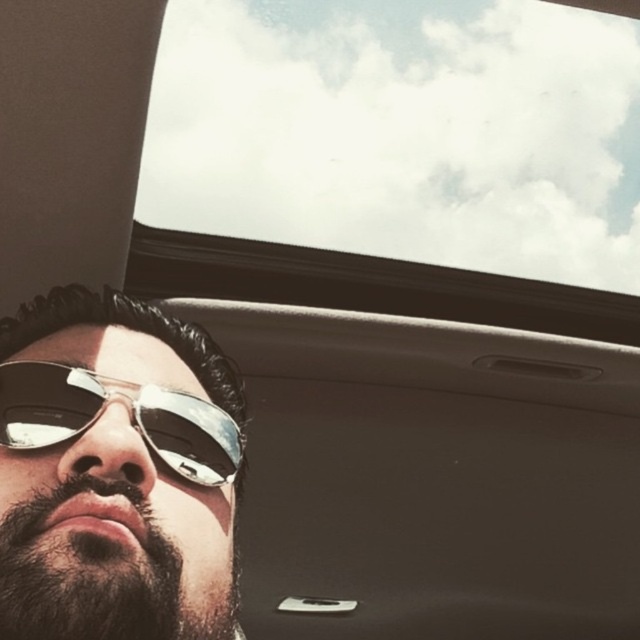
Question: Does transparent glass car window at upper center appear on the right side of dark brown fuzzy beard at lower left?

Choices:
 (A) no
 (B) yes

Answer: (B)

Question: Which point is farther to the camera?

Choices:
 (A) dark brown fuzzy beard at lower left
 (B) transparent glass car window at upper center
 (C) shiny metallic sunglasses at lower left

Answer: (B)

Question: Considering the relative positions of transparent glass car window at upper center and dark brown fuzzy beard at lower left in the image provided, where is transparent glass car window at upper center located with respect to dark brown fuzzy beard at lower left?

Choices:
 (A) left
 (B) right

Answer: (B)

Question: Among these points, which one is nearest to the camera?

Choices:
 (A) (13, 616)
 (B) (225, 273)
 (C) (221, 440)
 (D) (16, 552)

Answer: (A)

Question: Which point is closer to the camera?

Choices:
 (A) (189, 477)
 (B) (320, 44)

Answer: (A)

Question: Can you confirm if dark brown fuzzy beard at lower left is positioned to the right of metallic reflective sunglasses at lower left?

Choices:
 (A) no
 (B) yes

Answer: (B)